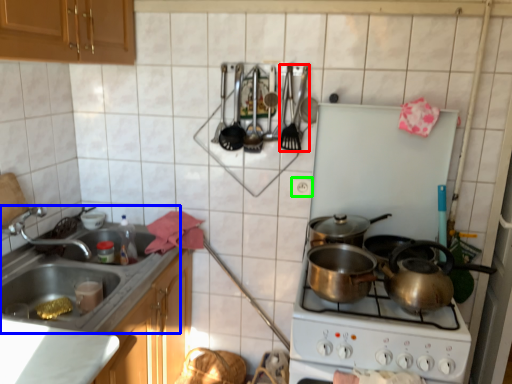
Question: Estimate the real-world distances between objects in this image. Which object is farther from silverware (highlighted by a red box), sink (highlighted by a blue box) or electric outlet (highlighted by a green box)?

Choices:
 (A) sink
 (B) electric outlet

Answer: (A)